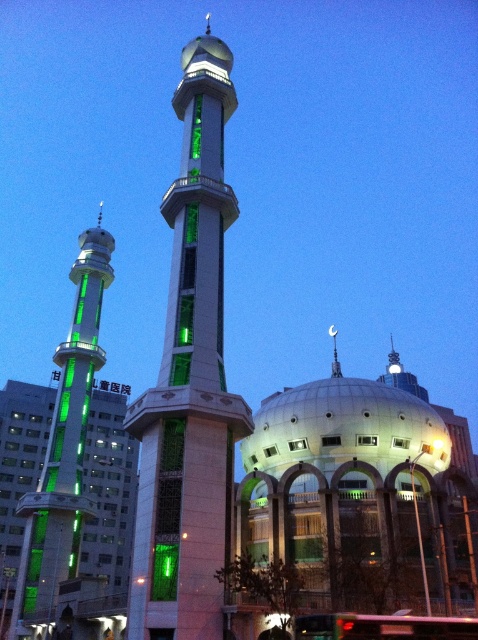
Question: Does green glass minaret at center come in front of green glass minaret at left?

Choices:
 (A) yes
 (B) no

Answer: (A)

Question: Can you confirm if green glass minaret at center is positioned above green glass minaret at left?

Choices:
 (A) no
 (B) yes

Answer: (B)

Question: Which point appears farthest from the camera in this image?

Choices:
 (A) [x=47, y=536]
 (B) [x=155, y=449]

Answer: (A)

Question: Does green glass minaret at center appear over green glass minaret at left?

Choices:
 (A) yes
 (B) no

Answer: (A)